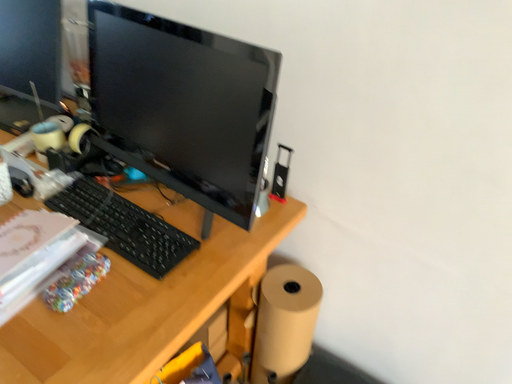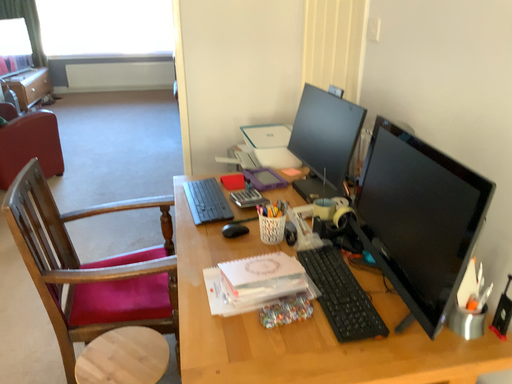
Question: How did the camera likely rotate when shooting the video?

Choices:
 (A) rotated right
 (B) rotated left

Answer: (B)